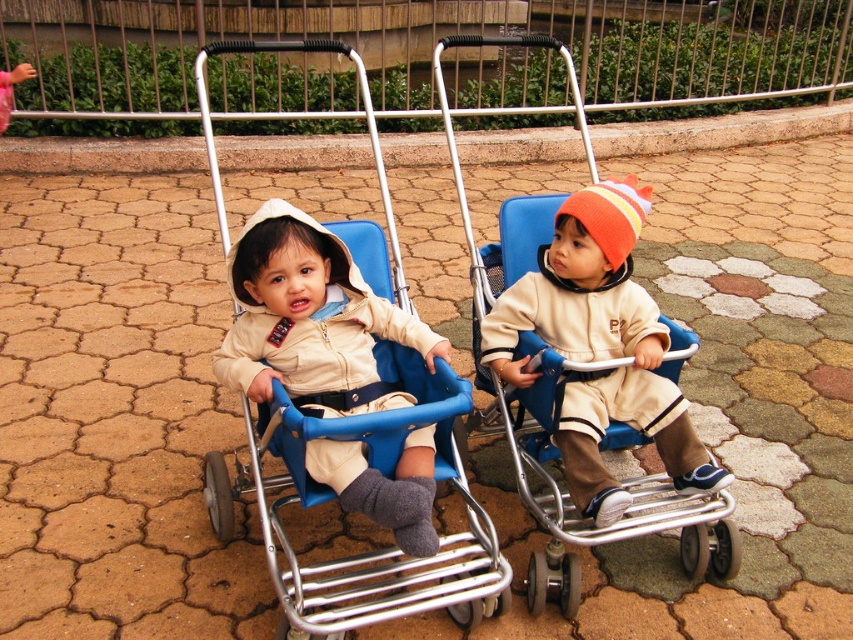
Who is higher up, metallic blue baby carriage at center or beige soft fabric jacket at center?

metallic blue baby carriage at center is above.

In the scene shown: Can you confirm if metallic blue baby carriage at center is positioned to the left of beige soft fabric jacket at center?

Yes, metallic blue baby carriage at center is to the left of beige soft fabric jacket at center.

Between point (264, 452) and point (341, 294), which one is positioned in front?

Point (341, 294) is more forward.

Locate an element on the screen. This screenshot has width=853, height=640. metallic blue baby carriage at center is located at coordinates (335, 497).

Is metallic blue baby carriage at center below matte beige sweater at center?

Incorrect, metallic blue baby carriage at center is not positioned below matte beige sweater at center.

Does metallic blue baby carriage at center have a greater height compared to matte beige sweater at center?

Correct, metallic blue baby carriage at center is much taller as matte beige sweater at center.

Who is more forward, (355, 618) or (619, 356)?

Point (355, 618)

Image resolution: width=853 pixels, height=640 pixels. In order to click on metallic blue baby carriage at center in this screenshot , I will do `click(335, 497)`.

Is beige soft fabric jacket at center thinner than matte beige sweater at center?

Yes, beige soft fabric jacket at center is thinner than matte beige sweater at center.

Does beige soft fabric jacket at center have a greater height compared to matte beige sweater at center?

Incorrect, beige soft fabric jacket at center's height is not larger of matte beige sweater at center's.

Does point (323, 474) lie in front of point (492, 332)?

Yes, it is.

Find the location of a particular element. The height and width of the screenshot is (640, 853). beige soft fabric jacket at center is located at coordinates (311, 321).